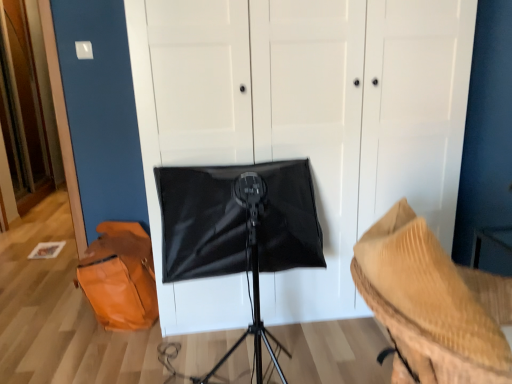
Locate an element on the screen. empty space that is in between orange leather messenger bag at lower left and black matte softbox at center is located at coordinates (137, 338).